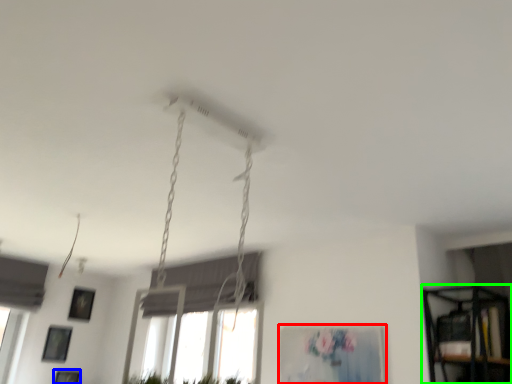
Question: Considering the real-world distances, which object is farthest from picture frame (highlighted by a red box)? picture frame (highlighted by a blue box) or shelf (highlighted by a green box)?

Choices:
 (A) picture frame
 (B) shelf

Answer: (A)